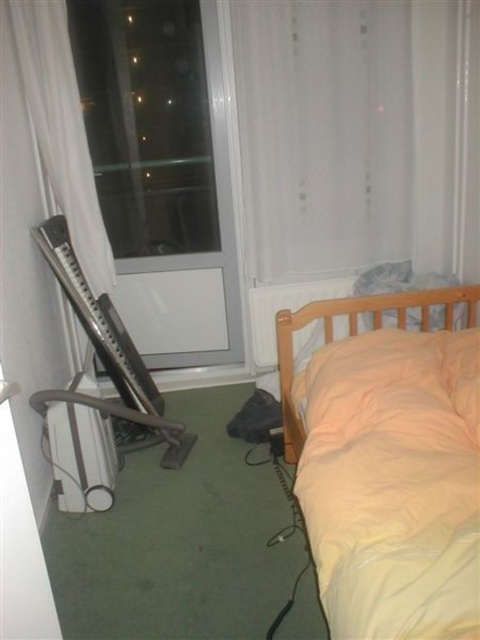
Question: Which point is farther to the camera?

Choices:
 (A) (92, 256)
 (B) (386, 298)

Answer: (A)

Question: Does transparent plastic screen door at left appear over white sheer curtain at left?

Choices:
 (A) no
 (B) yes

Answer: (A)

Question: Does transparent plastic screen door at left have a lesser width compared to white sheer curtain at left?

Choices:
 (A) no
 (B) yes

Answer: (A)

Question: Which point appears closest to the camera in this image?

Choices:
 (A) (155, 225)
 (B) (284, 419)
 (C) (83, 221)

Answer: (B)

Question: Does transparent plastic screen door at left come behind light orange fabric bed at right?

Choices:
 (A) yes
 (B) no

Answer: (A)

Question: Which point is closer to the camera taking this photo?

Choices:
 (A) (46, 102)
 (B) (118, 289)
 (C) (295, 451)

Answer: (C)